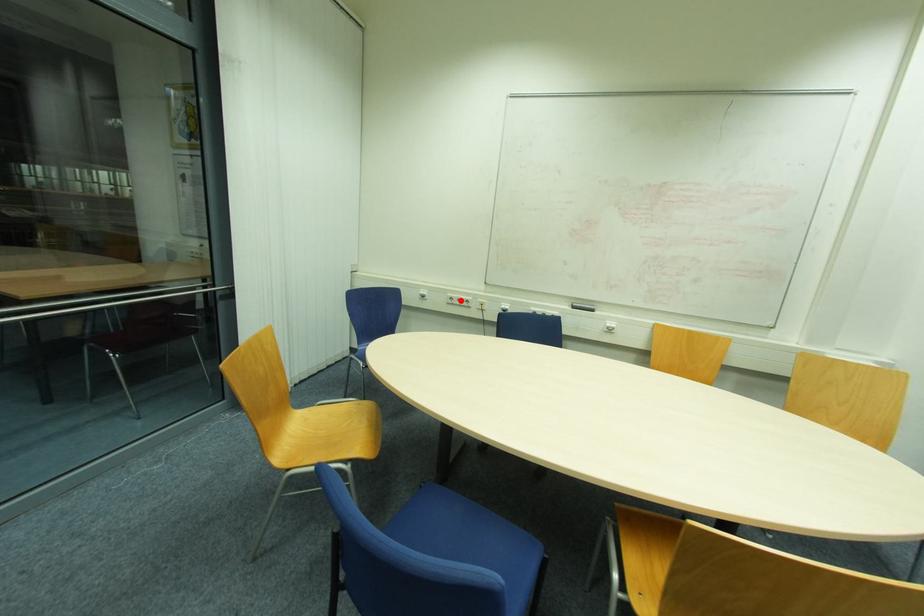
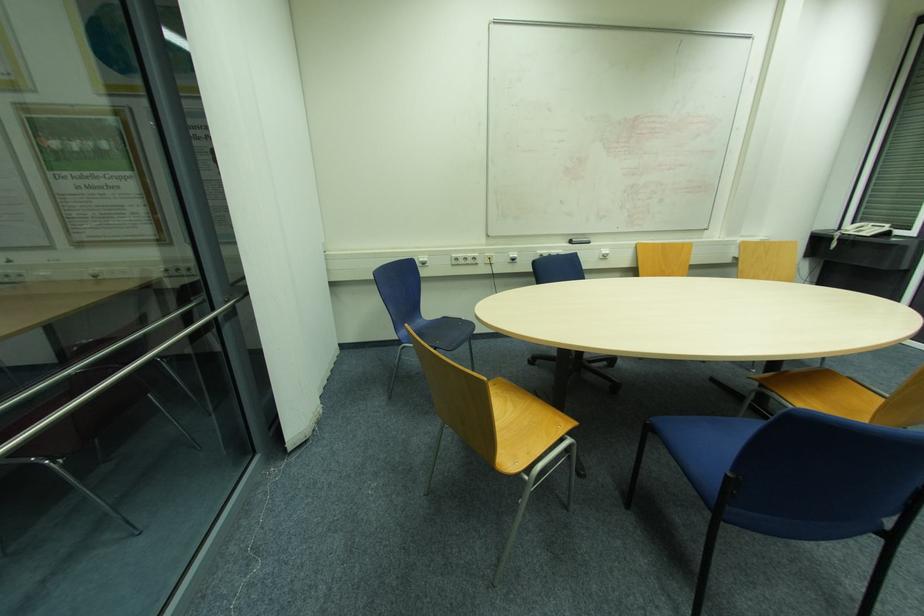
Locate, in the second image, the point that corresponds to the highlighted location in the first image.

(467, 259)